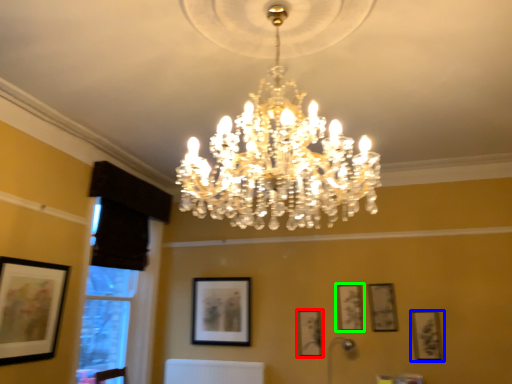
Question: Which is nearer to the picture frame (highlighted by a red box)? picture frame (highlighted by a blue box) or picture frame (highlighted by a green box).

Choices:
 (A) picture frame
 (B) picture frame

Answer: (B)